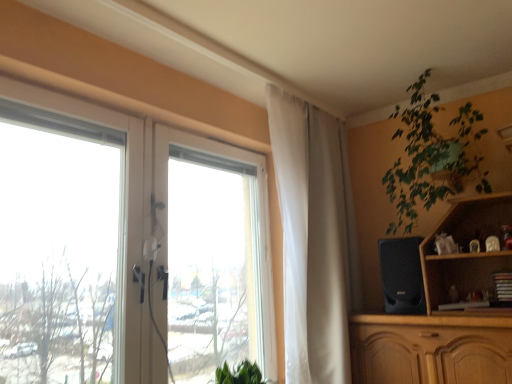
Question: Relative to transparent glass window at left, is green leafy plant at upper right in front or behind?

Choices:
 (A) behind
 (B) front

Answer: (A)

Question: From a real-world perspective, is green leafy plant at upper right positioned above or below transparent glass window at left?

Choices:
 (A) below
 (B) above

Answer: (B)

Question: Based on their relative distances, which object is nearer to the white sheer curtain at upper center?

Choices:
 (A) black matte speaker at right
 (B) green leafy plant at upper right
 (C) transparent glass window at left

Answer: (A)

Question: Considering the real-world distances, which object is closest to the green leafy plant at upper right?

Choices:
 (A) black matte speaker at right
 (B) white sheer curtain at upper center
 (C) transparent glass window at left

Answer: (A)